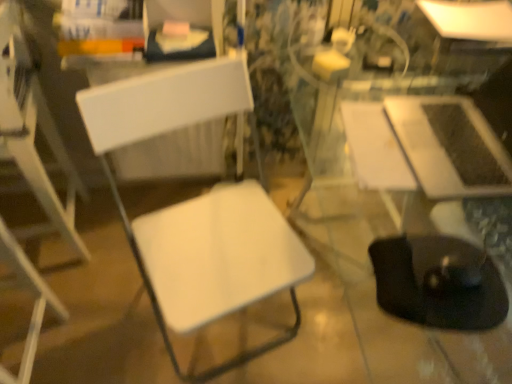
Question: Can you confirm if black rubber swivel chair at lower right is bigger than white matte chair at left, marked as the 1th chair in a right-to-left arrangement?

Choices:
 (A) no
 (B) yes

Answer: (A)

Question: From the image's perspective, is black rubber swivel chair at lower right over white matte chair at left, the 2th chair from the left?

Choices:
 (A) no
 (B) yes

Answer: (A)

Question: Does black rubber swivel chair at lower right turn towards white matte chair at left, marked as the 1th chair in a right-to-left arrangement?

Choices:
 (A) no
 (B) yes

Answer: (A)

Question: Is white matte chair at left, marked as the 1th chair in a right-to-left arrangement, inside black rubber swivel chair at lower right?

Choices:
 (A) yes
 (B) no

Answer: (B)

Question: Is black rubber swivel chair at lower right oriented away from white matte chair at left, the 2th chair from the left?

Choices:
 (A) yes
 (B) no

Answer: (B)

Question: From the image's perspective, is white glossy table at upper right, acting as the 1th table starting from the back, positioned above or below white matte chair at left, the 2th chair from the left?

Choices:
 (A) above
 (B) below

Answer: (A)

Question: Considering the positions of white glossy table at upper right, which is the 1th table in top-to-bottom order, and white matte chair at left, marked as the 1th chair in a right-to-left arrangement, in the image, is white glossy table at upper right, which is the 1th table in top-to-bottom order, bigger or smaller than white matte chair at left, marked as the 1th chair in a right-to-left arrangement,?

Choices:
 (A) small
 (B) big

Answer: (A)

Question: From their relative heights in the image, would you say white glossy table at upper right, acting as the 1th table starting from the back, is taller or shorter than white matte chair at left, marked as the 1th chair in a right-to-left arrangement?

Choices:
 (A) short
 (B) tall

Answer: (A)

Question: From a real-world perspective, is white glossy table at upper right, acting as the 1th table starting from the back, above or below white matte chair at left, marked as the 1th chair in a right-to-left arrangement?

Choices:
 (A) above
 (B) below

Answer: (A)

Question: From the image's perspective, is white plastic chair at left, marked as the second chair in a right-to-left arrangement, positioned above or below satin silver laptop at right, the first table from the bottom?

Choices:
 (A) below
 (B) above

Answer: (A)

Question: In terms of height, does white plastic chair at left, the 1th chair when ordered from left to right, look taller or shorter compared to satin silver laptop at right, the first table from the bottom?

Choices:
 (A) short
 (B) tall

Answer: (B)

Question: From a real-world perspective, is white plastic chair at left, the 1th chair when ordered from left to right, physically located above or below satin silver laptop at right, which appears as the second table when viewed from the back?

Choices:
 (A) below
 (B) above

Answer: (A)

Question: Choose the correct answer: Is white plastic chair at left, marked as the second chair in a right-to-left arrangement, inside satin silver laptop at right, placed as the first table when sorted from front to back, or outside it?

Choices:
 (A) inside
 (B) outside

Answer: (B)

Question: From a real-world perspective, is white matte chair at left, marked as the 1th chair in a right-to-left arrangement, physically located above or below white glossy table at upper right, the 2th table positioned from the bottom?

Choices:
 (A) above
 (B) below

Answer: (B)

Question: Is white matte chair at left, marked as the 1th chair in a right-to-left arrangement, wider or thinner than white glossy table at upper right, which is the 1th table in top-to-bottom order?

Choices:
 (A) thin
 (B) wide

Answer: (B)